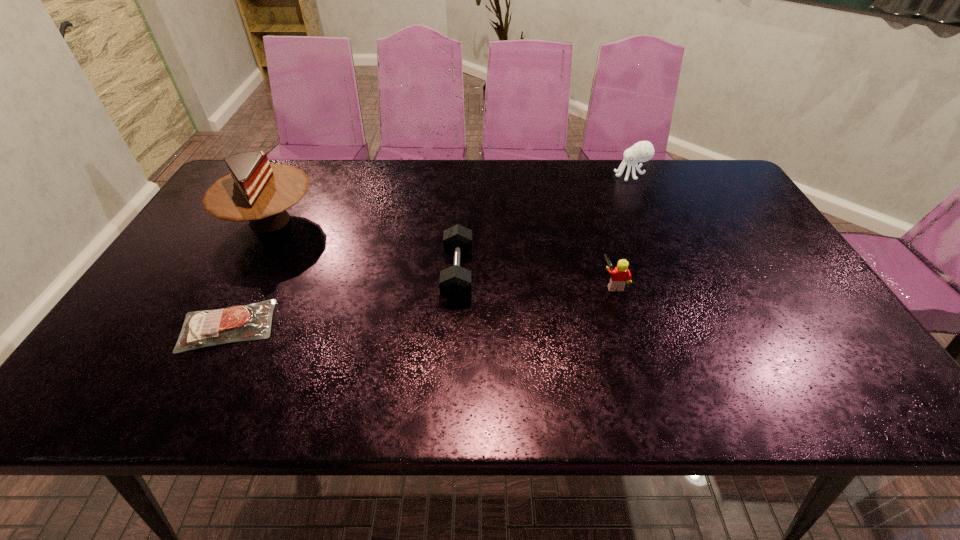
This screenshot has width=960, height=540. In the image, there is a desktop. Find the location of `vacant region at the far edge`. vacant region at the far edge is located at coordinates (409, 189).

Locate an element on the screen. blank area at the near edge is located at coordinates (493, 401).

Where is `vacant space at the left edge`? This screenshot has width=960, height=540. vacant space at the left edge is located at coordinates (155, 312).

In the image, there is a desktop. Where is `free space at the right edge`? The image size is (960, 540). free space at the right edge is located at coordinates (747, 258).

Image resolution: width=960 pixels, height=540 pixels. Identify the location of vacant space at the near right corner of the desktop. (860, 402).

Identify the location of vacant region between the shortest object and the second object from right to left. The width and height of the screenshot is (960, 540). (420, 305).

I want to click on free spot between the Lego and the steak, so click(420, 305).

Locate an element on the screen. Image resolution: width=960 pixels, height=540 pixels. free point between the farthest object and the cake is located at coordinates (450, 198).

The image size is (960, 540). In order to click on vacant area that lies between the dumbbell and the steak in this screenshot , I will do `click(343, 300)`.

This screenshot has width=960, height=540. Identify the location of vacant area that lies between the fourth shortest object and the tallest object. (450, 198).